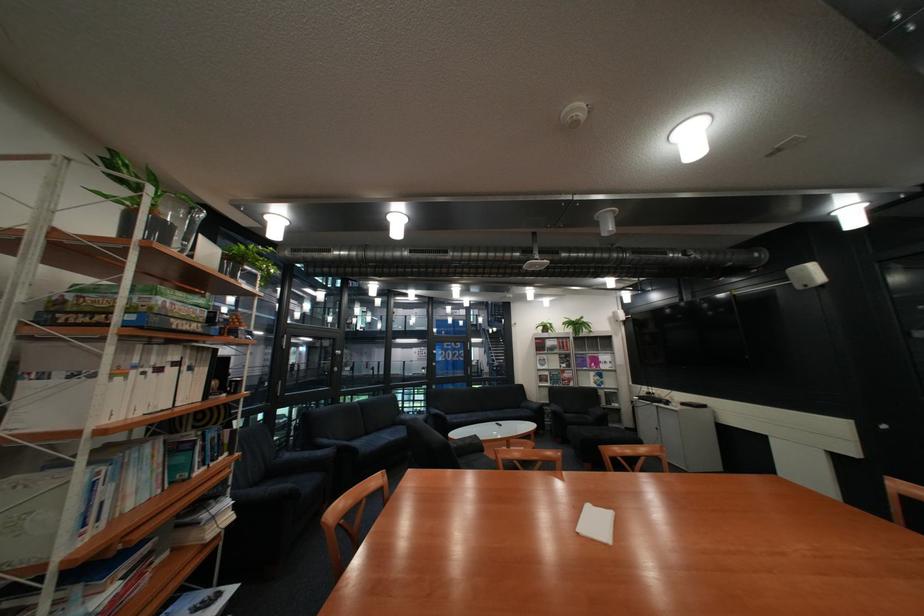
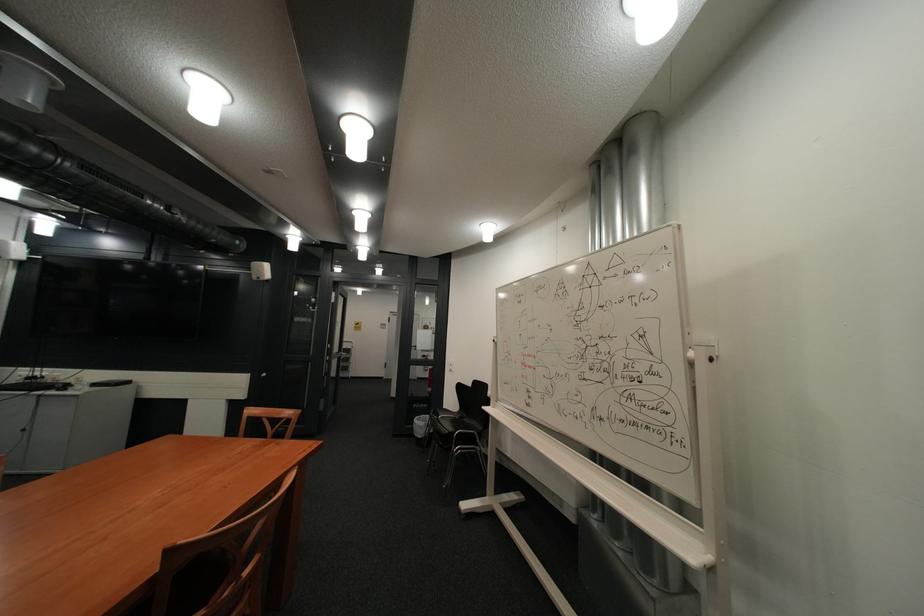
Question: The camera is either moving clockwise (left) or counter-clockwise (right) around the object. The first image is from the beginning of the video and the second image is from the end. Is the camera moving left or right when shooting the video?

Choices:
 (A) Left
 (B) Right

Answer: (A)